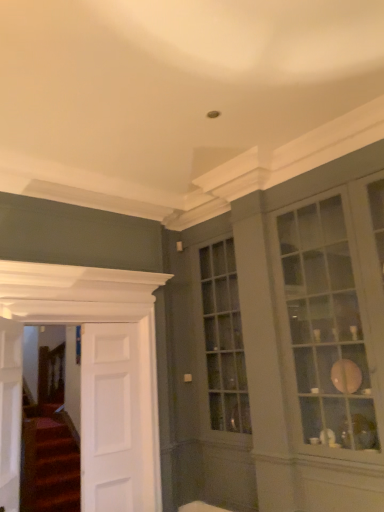
This screenshot has width=384, height=512. I want to click on vacant space situated above white wooden door at left, placed as the second door when sorted from right to left (from a real-world perspective), so click(x=81, y=302).